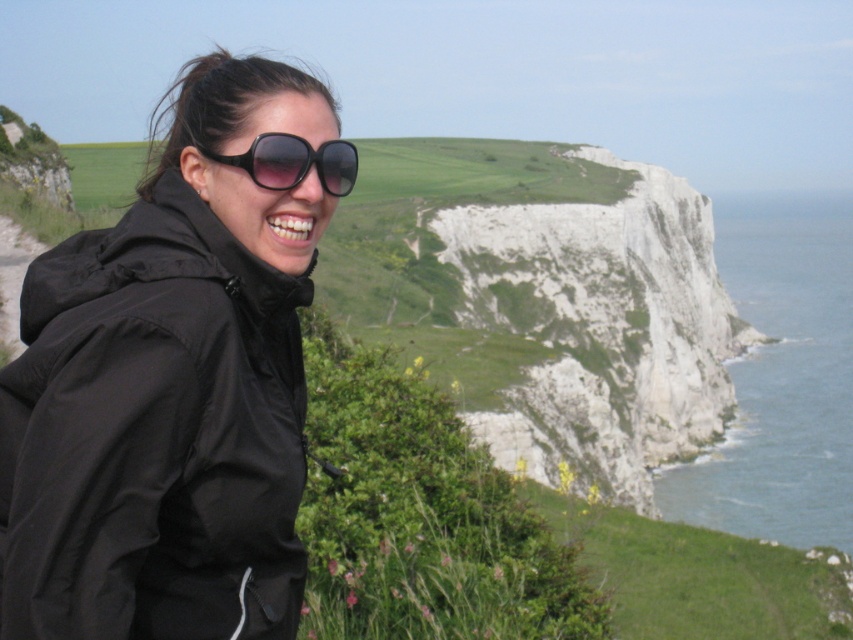
You are standing at the point labeled point (294, 566). You want to walk to the edge of the cliff to take a photo. The cliff edge is 30 meters away from your current position. Can you safely walk to the edge without exceeding the safe distance of 25 meters?

The distance between you and the cliff edge is 28.54 meters, which exceeds the safe distance of 25 meters. Therefore, you should not proceed to the edge as it is beyond the recommended safety limit.

You are a drone operator trying to capture a photo of the black matte jacket at left and the black plastic sunglasses at upper center. The minimum distance your drone can focus is 3 meters. Will the drone be able to capture both objects clearly in the same photo?

The distance between the black matte jacket at left and the black plastic sunglasses at upper center is 3.78 meters. Since the minimum focus distance is 3 meters, the drone can capture both objects clearly as the distance is within the required range.

You are a photographer trying to capture the person in the image. The person is wearing a black matte jacket at left. If you want to focus on their face, which part of the image should you adjust your camera to point towards?

You should adjust your camera to point towards the black matte jacket at left since it is located at point (x=154, y=435), which would help you focus on the person wearing it, including their face.